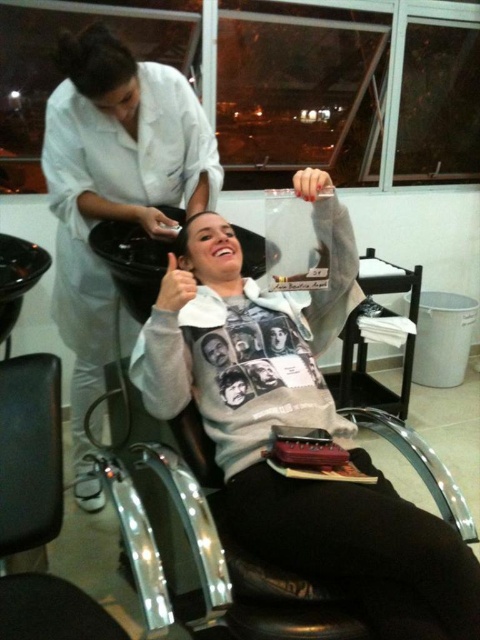
Between white matte sweatshirt at center and white matte hairdresser at upper left, which one appears on the left side from the viewer's perspective?

white matte hairdresser at upper left is more to the left.

Is white matte sweatshirt at center below white matte hairdresser at upper left?

Indeed, white matte sweatshirt at center is positioned under white matte hairdresser at upper left.

Which is behind, point (399, 522) or point (191, 179)?

The point (191, 179) is more distant.

The image size is (480, 640). In order to click on white matte sweatshirt at center in this screenshot , I will do `click(296, 424)`.